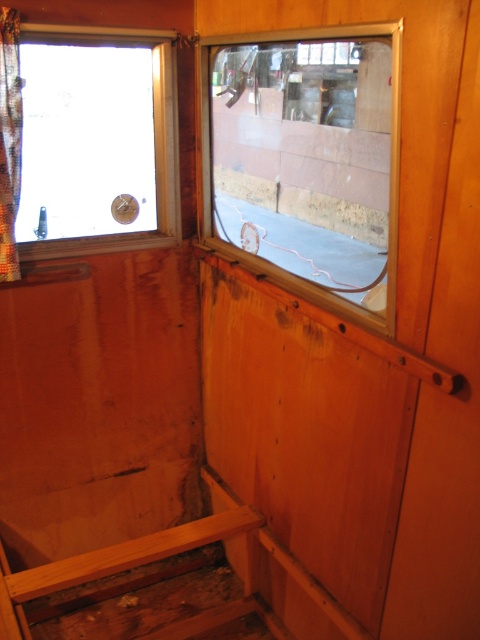
You are standing inside the wooden cabin and want to look outside through the clear glass window at center. Where should you position yourself to see the window?

You should position yourself near the center of the cabin because the clear glass window at center is located at point (307,157), which is centrally positioned in the space.

You are a painter who needs to place a ladder between the clear glass window at center and the clear glass window at upper left. The ladder is 6 feet long. Will the ladder fit between them?

The distance between the clear glass window at center and the clear glass window at upper left is 5.73 feet, so the ladder that is 6 feet long will fit between them since it is slightly longer than the distance between the windows.

You are inside the cabin and want to let in more natural light. Which window, the clear glass window at center or the clear glass window at upper left, should you open to achieve this?

The clear glass window at upper left is higher up, so opening it would allow more natural light to enter from above, while the clear glass window at center is lower and might be obstructed by the curtain. However, since the clear glass window at center is below the one at upper left, opening both could maximize light intake.